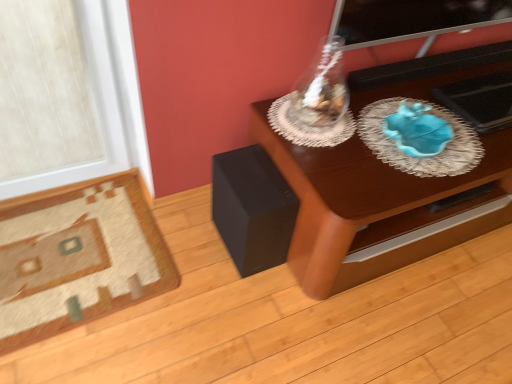
Question: Does transparent glass vase at upper center have a greater width compared to carpeted rug at lower left?

Choices:
 (A) yes
 (B) no

Answer: (B)

Question: Are transparent glass vase at upper center and carpeted rug at lower left far apart?

Choices:
 (A) yes
 (B) no

Answer: (B)

Question: Is transparent glass vase at upper center positioned in front of carpeted rug at lower left?

Choices:
 (A) no
 (B) yes

Answer: (B)

Question: Would you say transparent glass vase at upper center contains carpeted rug at lower left?

Choices:
 (A) no
 (B) yes

Answer: (A)

Question: From the image's perspective, would you say transparent glass vase at upper center is shown under carpeted rug at lower left?

Choices:
 (A) yes
 (B) no

Answer: (B)

Question: From the image's perspective, is blue glass plate at right positioned above or below wooden table at center?

Choices:
 (A) above
 (B) below

Answer: (A)

Question: Is blue glass plate at right in front of or behind wooden table at center in the image?

Choices:
 (A) front
 (B) behind

Answer: (B)

Question: Is point (435, 165) positioned closer to the camera than point (497, 66)?

Choices:
 (A) farther
 (B) closer

Answer: (B)

Question: From their relative heights in the image, would you say blue glass plate at right is taller or shorter than wooden table at center?

Choices:
 (A) tall
 (B) short

Answer: (B)

Question: Choose the correct answer: Is black matte speaker at lower left inside blue glass plate at right or outside it?

Choices:
 (A) outside
 (B) inside

Answer: (A)

Question: Does point (266, 158) appear closer or farther from the camera than point (400, 112)?

Choices:
 (A) closer
 (B) farther

Answer: (A)

Question: From the image's perspective, is black matte speaker at lower left above or below blue glass plate at right?

Choices:
 (A) below
 (B) above

Answer: (A)

Question: Is black matte speaker at lower left taller or shorter than blue glass plate at right?

Choices:
 (A) tall
 (B) short

Answer: (A)

Question: From a real-world perspective, is wooden table at center positioned above or below black matte speaker at lower left?

Choices:
 (A) above
 (B) below

Answer: (A)

Question: Looking at the image, does wooden table at center seem bigger or smaller compared to black matte speaker at lower left?

Choices:
 (A) small
 (B) big

Answer: (B)